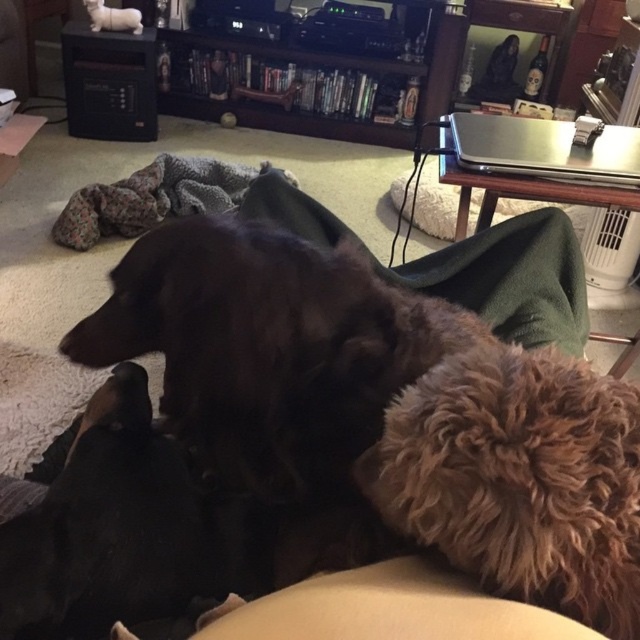
Question: Which object is positioned farthest from the white plush cat at upper left?

Choices:
 (A) shiny black dog at center
 (B) wooden entertainment center at upper center
 (C) green soft blanket at center

Answer: (A)

Question: Can you confirm if shiny black dog at center is bigger than wooden entertainment center at upper center?

Choices:
 (A) yes
 (B) no

Answer: (B)

Question: Where is shiny black dog at center located in relation to white plush cat at upper left in the image?

Choices:
 (A) below
 (B) above

Answer: (A)

Question: Which point appears farthest from the camera in this image?

Choices:
 (A) (241, 60)
 (B) (248, 429)
 (C) (570, 346)
 (D) (124, 8)

Answer: (A)

Question: Does shiny black dog at center have a greater width compared to wooden entertainment center at upper center?

Choices:
 (A) yes
 (B) no

Answer: (B)

Question: Considering the real-world distances, which object is farthest from the white plush cat at upper left?

Choices:
 (A) green soft blanket at center
 (B) shiny black dog at center

Answer: (B)